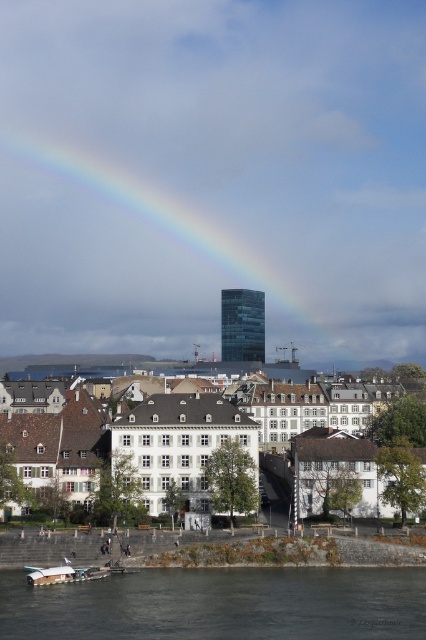
You are a photographer trying to capture the rainbow glass at upper center and the clear water at lower center in the same frame. Which object should you position closer to the left side of your camera viewfinder to include both in the shot?

To include both the rainbow glass at upper center and the clear water at lower center in the same frame, position the rainbow glass at upper center closer to the left side of your camera viewfinder since it is already located to the left of the clear water at lower center.

You are standing at the shore of the river and want to take a photo of the rainbow glass at upper center. Given that the rainbow glass is at coordinates point 0.384, 0.399, where should you position yourself to capture it in the frame?

The rainbow glass at upper center is located at point [169,244], so you should position yourself at the shore facing towards the upper center to capture it in the frame.